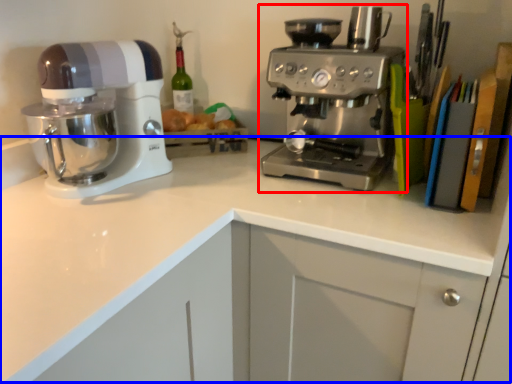
Question: Among these objects, which one is nearest to the camera, coffee maker (highlighted by a red box) or counter top (highlighted by a blue box)?

Choices:
 (A) coffee maker
 (B) counter top

Answer: (B)